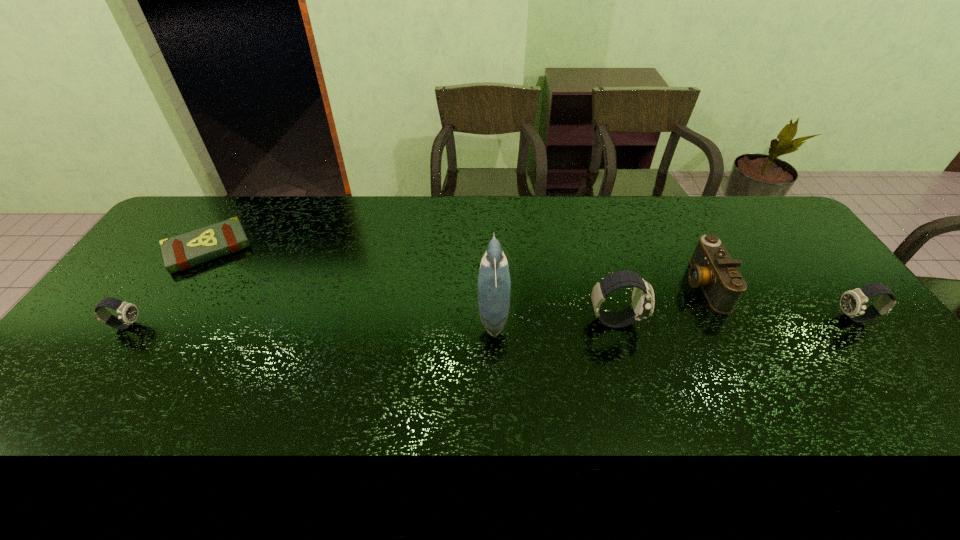
Image resolution: width=960 pixels, height=540 pixels. Identify the location of vacant area at the right edge of the desktop. (842, 333).

Locate an element on the screen. Image resolution: width=960 pixels, height=540 pixels. vacant space at the near right corner of the desktop is located at coordinates (913, 416).

This screenshot has width=960, height=540. In order to click on free space between the second tallest watch and the book in this screenshot , I will do coord(532,284).

Identify the location of empty location between the fifth tallest object and the fifth object from left to right. This screenshot has width=960, height=540. (415, 305).

I want to click on free space between the fifth shortest object and the rightmost object, so click(734, 320).

Image resolution: width=960 pixels, height=540 pixels. I want to click on free space that is in between the third object from left to right and the fifth shortest object, so click(554, 317).

Where is `blank region between the second shortest object and the shortest object`? This screenshot has width=960, height=540. blank region between the second shortest object and the shortest object is located at coordinates (167, 287).

This screenshot has height=540, width=960. In order to click on vacant area that lies between the third object from left to right and the shortest watch in this screenshot , I will do `click(310, 319)`.

At what (x,y) coordinates should I click in order to perform the action: click on vacant space in between the camera and the book. Please return your answer as a coordinate pair (x, y). Looking at the image, I should click on (456, 267).

Identify the location of free area in between the shortest object and the camera. This screenshot has height=540, width=960. (456, 267).